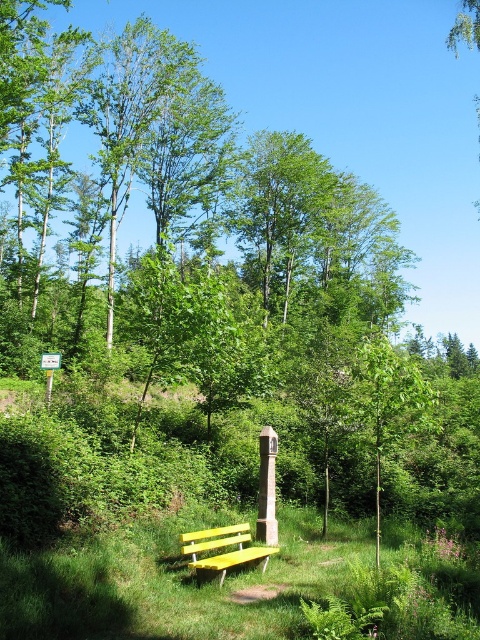
In the scene shown: You are a gardener planning to plant flowers between the green grass at lower center and the yellow painted wood bench at lower center. Based on their positions, where should you place the flowers so they are visible from the path that runs behind the bench?

The green grass at lower center is above the yellow painted wood bench at lower center, so placing the flowers between them would make them visible from the path behind the bench since the grass is higher up and the bench is lower.

You are a gardener who needs to mow the green grass at lower center and yellow painted wood bench at lower center. Which object should you mow first if you want to start with the shorter one?

The green grass at lower center is shorter than the yellow painted wood bench at lower center, so you should mow the green grass at lower center first.